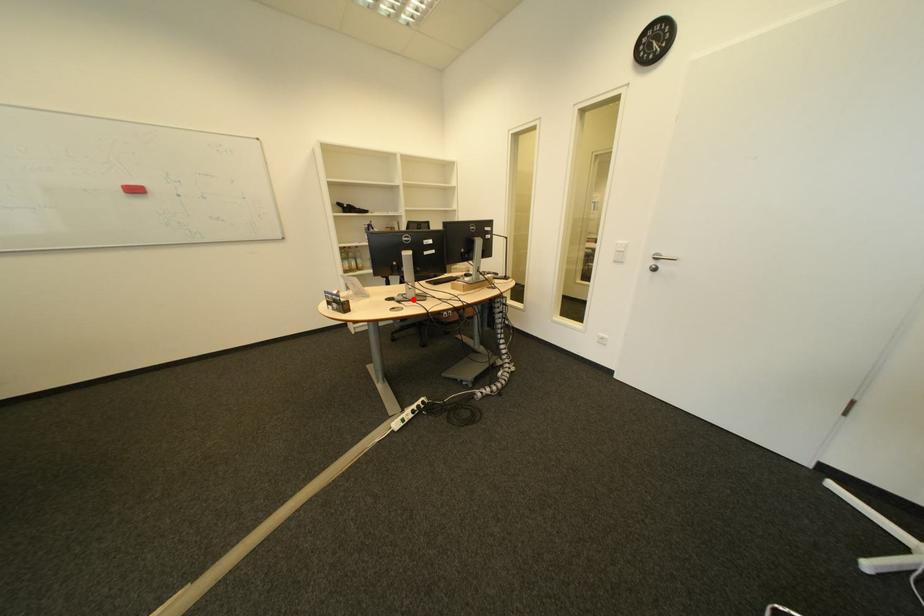
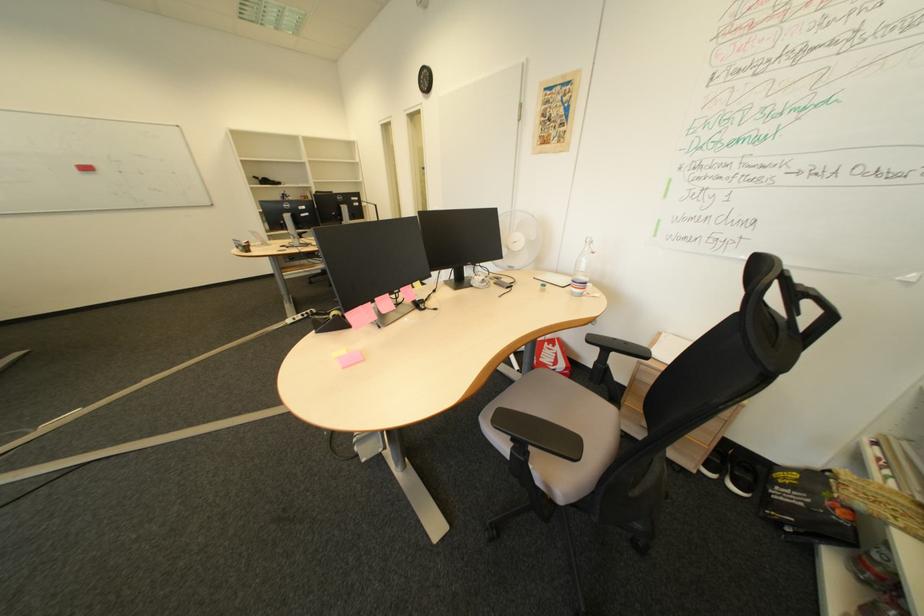
Question: I am providing you with two images of the same scene from different viewpoints. Image1 has a red point marked. In image2, the corresponding 3D location appears at what relative position? Reply with the corresponding letter.

Choices:
 (A) Closer
 (B) Farther

Answer: (A)